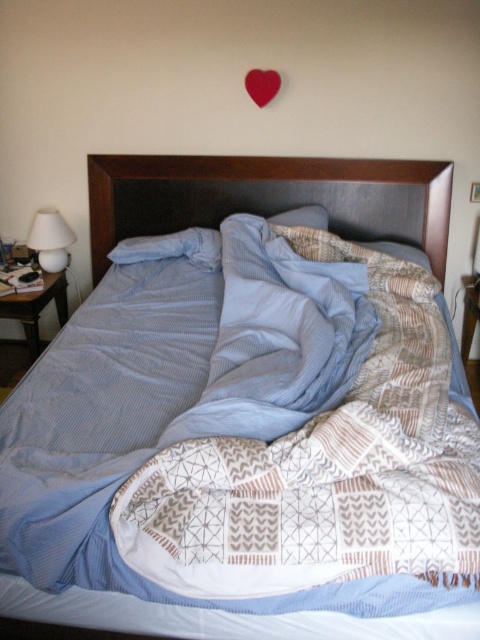
Between dark brown fabric headboard at center and white glossy lamp at left, which one is positioned higher?

dark brown fabric headboard at center is higher up.

Where is `dark brown fabric headboard at center`? The height and width of the screenshot is (640, 480). dark brown fabric headboard at center is located at coordinates (268, 196).

Is dark brown fabric headboard at center taller than matte red heart at upper center?

Yes, dark brown fabric headboard at center is taller than matte red heart at upper center.

Describe the element at coordinates (268, 196) in the screenshot. This screenshot has width=480, height=640. I see `dark brown fabric headboard at center` at that location.

This screenshot has height=640, width=480. Find the location of `dark brown fabric headboard at center`. dark brown fabric headboard at center is located at coordinates (268, 196).

Is white glossy lamp at left above matte red heart at upper center?

Incorrect, white glossy lamp at left is not positioned above matte red heart at upper center.

Can you confirm if white glossy lamp at left is positioned to the left of matte red heart at upper center?

Yes, white glossy lamp at left is to the left of matte red heart at upper center.

Is point (55, 241) positioned after point (250, 93)?

Yes, point (55, 241) is behind point (250, 93).

This screenshot has width=480, height=640. I want to click on white glossy lamp at left, so click(50, 240).